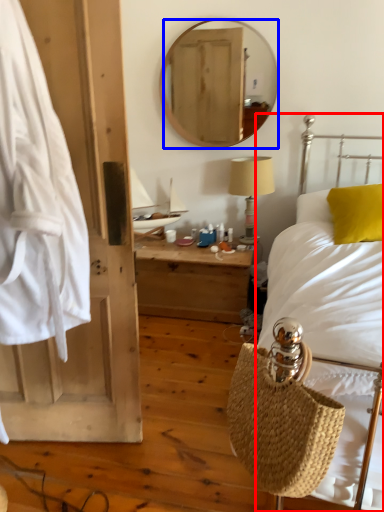
Question: Which point is further to the camera, bed (highlighted by a red box) or mirror (highlighted by a blue box)?

Choices:
 (A) bed
 (B) mirror

Answer: (B)